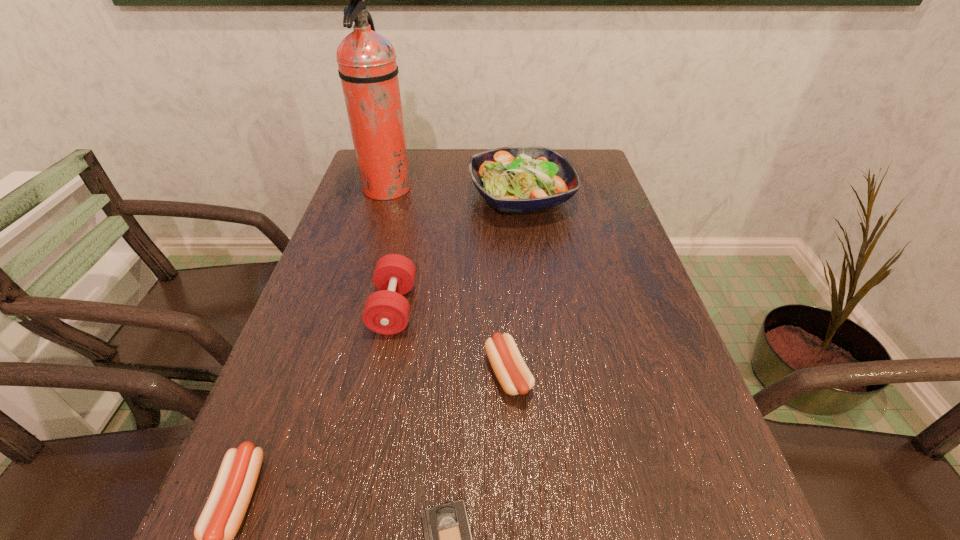
Locate an element on the screen. fire extinguisher present at the far edge is located at coordinates pyautogui.click(x=368, y=69).

Locate an element on the screen. This screenshot has width=960, height=540. salad plate that is at the far edge is located at coordinates (517, 179).

Find the location of a particular element. The width and height of the screenshot is (960, 540). fire extinguisher situated at the left edge is located at coordinates (368, 69).

Find the location of a particular element. dumbbell that is at the left edge is located at coordinates (386, 311).

Locate an element on the screen. The height and width of the screenshot is (540, 960). object located in the right edge section of the desktop is located at coordinates (517, 179).

Identify the location of object present at the far left corner. The width and height of the screenshot is (960, 540). (368, 69).

I want to click on object that is at the far right corner, so click(517, 179).

What are the coordinates of `vacant space at the far edge` in the screenshot? It's located at (424, 178).

I want to click on vacant space at the left edge, so click(x=317, y=303).

In the image, there is a desktop. What are the coordinates of `vacant space at the right edge` in the screenshot? It's located at (584, 198).